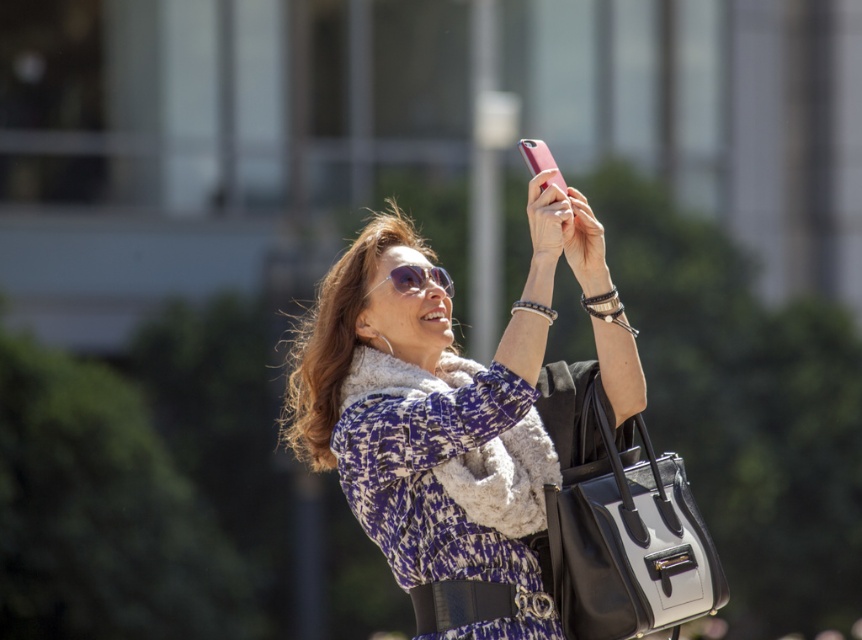
This screenshot has width=862, height=640. What do you see at coordinates (428, 390) in the screenshot? I see `matte black jacket at center` at bounding box center [428, 390].

You are a GUI agent. You are given a task and a screenshot of the screen. Output one action in this format:
    pyautogui.click(x=<x>, y=<y>)
    Task: Click on the matte black jacket at center
    This screenshot has height=640, width=862.
    Given the screenshot: What is the action you would take?
    pyautogui.click(x=428, y=390)

Who is more distant from viewer, (373,273) or (417,284)?

Point (417,284)

What are the coordinates of `matte black jacket at center` in the screenshot? It's located at (428, 390).

Looking at this image, is matte black jacket at center further to camera compared to black leather handbag at lower right?

Yes, it is behind black leather handbag at lower right.

Does matte black jacket at center have a lesser height compared to black leather handbag at lower right?

No.

The image size is (862, 640). Identify the location of matte black jacket at center. (428, 390).

Is black leather handbag at lower right shorter than shiny silver sunglasses at center?

Incorrect, black leather handbag at lower right's height does not fall short of shiny silver sunglasses at center's.

Does black leather handbag at lower right have a larger size compared to shiny silver sunglasses at center?

Indeed, black leather handbag at lower right has a larger size compared to shiny silver sunglasses at center.

Image resolution: width=862 pixels, height=640 pixels. I want to click on black leather handbag at lower right, so click(626, 540).

This screenshot has width=862, height=640. Find the location of `black leather handbag at lower right`. black leather handbag at lower right is located at coordinates (626, 540).